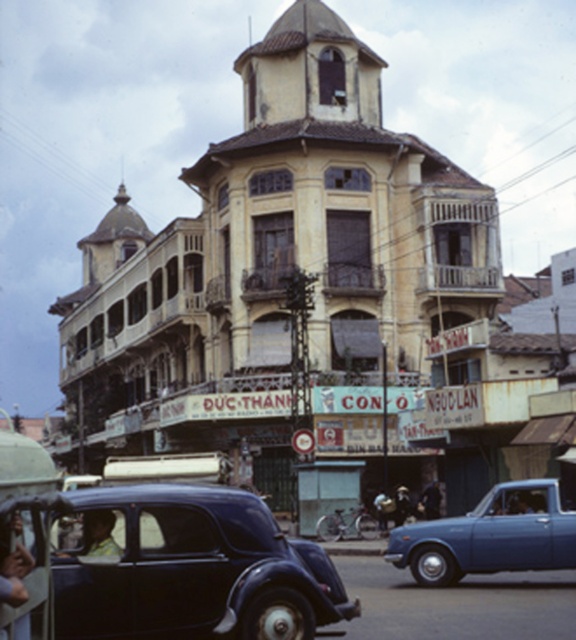
Does light brown leather jacket at lower left have a larger size compared to dark blue fabric jacket at center?

Incorrect, light brown leather jacket at lower left is not larger than dark blue fabric jacket at center.

Who is more distant from viewer, (29, 636) or (419, 506)?

The point (419, 506) is behind.

Does point (14, 557) come in front of point (433, 484)?

That is True.

At what (x,y) coordinates should I click in order to perform the action: click on light brown leather jacket at lower left. Please return your answer as a coordinate pair (x, y). Image resolution: width=576 pixels, height=640 pixels. Looking at the image, I should click on (14, 573).

Who is higher up, metallic blue sedan at center or dark blue fabric jacket at center?

metallic blue sedan at center

Does metallic blue sedan at center have a larger size compared to dark blue fabric jacket at center?

Indeed, metallic blue sedan at center has a larger size compared to dark blue fabric jacket at center.

This screenshot has width=576, height=640. Describe the element at coordinates (490, 536) in the screenshot. I see `metallic blue sedan at center` at that location.

Locate an element on the screen. This screenshot has height=640, width=576. metallic blue sedan at center is located at coordinates (490, 536).

Is shiny black car at center-left shorter than light brown leather jacket at lower left?

No, shiny black car at center-left is not shorter than light brown leather jacket at lower left.

Is shiny black car at center-left above light brown leather jacket at lower left?

Actually, shiny black car at center-left is below light brown leather jacket at lower left.

Is point (166, 506) in front of point (21, 556)?

No, (166, 506) is further to viewer.

At what (x,y) coordinates should I click in order to perform the action: click on shiny black car at center-left. Please return your answer as a coordinate pair (x, y). Looking at the image, I should click on (191, 570).